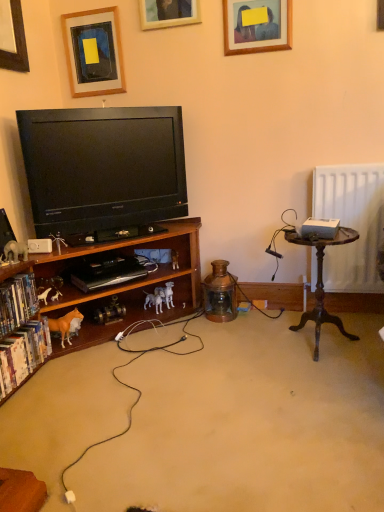
The image size is (384, 512). Identify the location of free space in front of wooden vintage table at right. (321, 378).